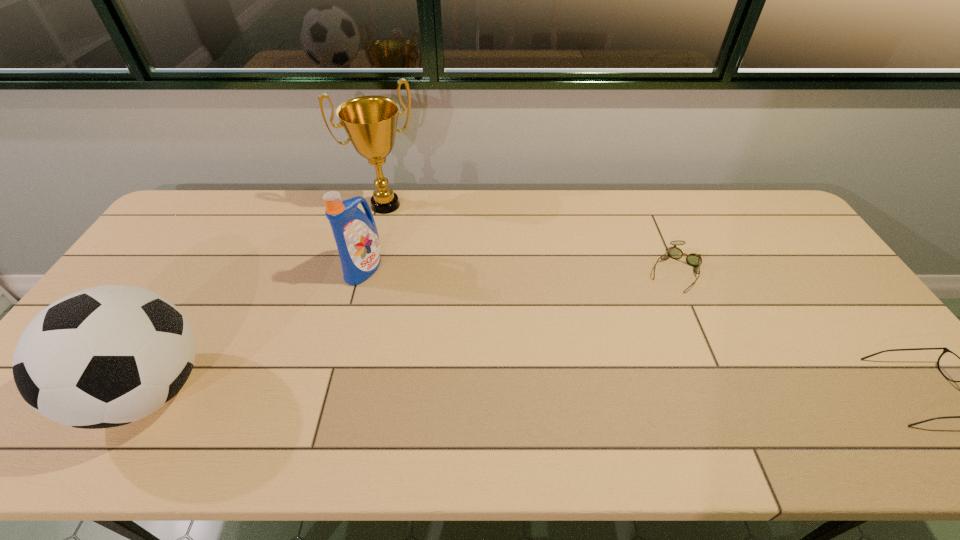
Where is `soccer ball`? The height and width of the screenshot is (540, 960). soccer ball is located at coordinates (106, 356).

Where is `detergent`? The height and width of the screenshot is (540, 960). detergent is located at coordinates (355, 232).

Identify the location of the left spectacles. This screenshot has width=960, height=540. (693, 259).

What are the coordinates of `the farther spectacles` in the screenshot? It's located at (693, 259).

At what (x,y) coordinates should I click in order to perform the action: click on award. Please return your answer as a coordinate pair (x, y). The width and height of the screenshot is (960, 540). Looking at the image, I should click on (370, 122).

The height and width of the screenshot is (540, 960). What are the coordinates of `the tallest object` in the screenshot? It's located at (370, 122).

Locate an element on the screen. This screenshot has height=540, width=960. free space located on the right of the soccer ball is located at coordinates (317, 391).

The image size is (960, 540). I want to click on free space located on the label of the detergent, so click(x=419, y=313).

At what (x,y) coordinates should I click in order to perform the action: click on blank area located on the label of the detergent. Please return your answer as a coordinate pair (x, y). Image resolution: width=960 pixels, height=540 pixels. Looking at the image, I should click on (434, 324).

Locate an element on the screen. The width and height of the screenshot is (960, 540). vacant space located 0.110m on the label of the detergent is located at coordinates (399, 299).